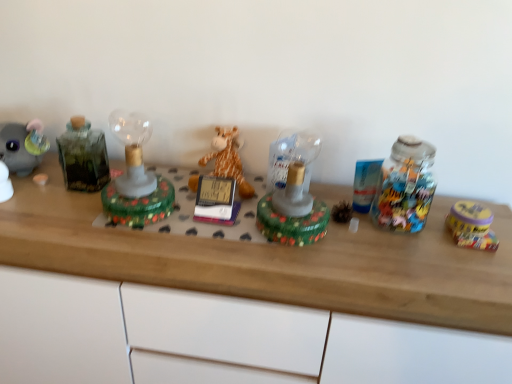
The width and height of the screenshot is (512, 384). In order to click on vacant space to the left of translucent glass lamp at center, the third toy when ordered from left to right in this screenshot , I will do `click(216, 241)`.